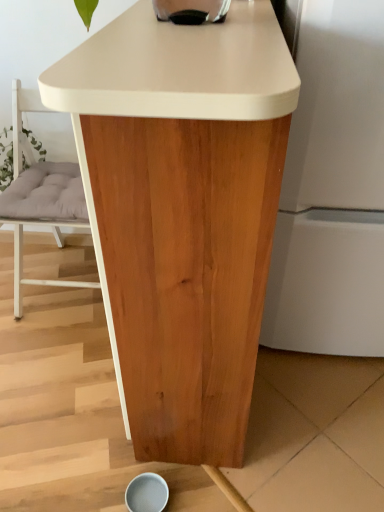
Locate an element on the screen. This screenshot has width=384, height=512. natural wood table at center is located at coordinates pos(182,212).

What do you see at coordinates (182, 212) in the screenshot? This screenshot has height=512, width=384. I see `natural wood table at center` at bounding box center [182, 212].

This screenshot has height=512, width=384. I want to click on light gray cushioned chair at center, so [x=39, y=195].

This screenshot has height=512, width=384. Describe the element at coordinates (39, 195) in the screenshot. I see `light gray cushioned chair at center` at that location.

The height and width of the screenshot is (512, 384). Identify the location of natural wood table at center. (182, 212).

From the picture: Is light gray cushioned chair at center at the left side of natural wood table at center?

Indeed, light gray cushioned chair at center is positioned on the left side of natural wood table at center.

From the picture: Is light gray cushioned chair at center further to camera compared to natural wood table at center?

Yes, light gray cushioned chair at center is further from the viewer.

Which is less distant, [19,96] or [293,100]?

Point [19,96].

From the image's perspective, is light gray cushioned chair at center beneath natural wood table at center?

No, from the image's perspective, light gray cushioned chair at center is not below natural wood table at center.

From a real-world perspective, is light gray cushioned chair at center under natural wood table at center?

Indeed, from a real-world perspective, light gray cushioned chair at center is positioned beneath natural wood table at center.

Can you confirm if light gray cushioned chair at center is thinner than natural wood table at center?

No, light gray cushioned chair at center is not thinner than natural wood table at center.

From their relative heights in the image, would you say light gray cushioned chair at center is taller or shorter than natural wood table at center?

In the image, light gray cushioned chair at center appears to be shorter than natural wood table at center.

Does light gray cushioned chair at center have a smaller size compared to natural wood table at center?

Yes.

Would you say light gray cushioned chair at center is inside or outside natural wood table at center?

light gray cushioned chair at center is located beyond the bounds of natural wood table at center.

Are light gray cushioned chair at center and natural wood table at center located far from each other?

Actually, light gray cushioned chair at center and natural wood table at center are a little close together.

Could you tell me if light gray cushioned chair at center is turned towards natural wood table at center?

No, light gray cushioned chair at center does not turn towards natural wood table at center.

How many degrees apart are the facing directions of light gray cushioned chair at center and natural wood table at center?

91 degrees.

Where is `chair that appears below the natural wood table at center (from a real-world perspective)`? chair that appears below the natural wood table at center (from a real-world perspective) is located at coordinates (39, 195).

Does natural wood table at center appear on the left side of light gray cushioned chair at center?

No.

Is natural wood table at center closer to the viewer compared to light gray cushioned chair at center?

Yes, natural wood table at center is closer to the camera.

Which is closer, [215,139] or [84,200]?

Point [215,139] is positioned closer to the camera compared to point [84,200].

From the image's perspective, does natural wood table at center appear lower than light gray cushioned chair at center?

Correct, natural wood table at center appears lower than light gray cushioned chair at center in the image.

From a real-world perspective, who is located higher, natural wood table at center or light gray cushioned chair at center?

From a 3D spatial view, natural wood table at center is above.

Considering the relative sizes of natural wood table at center and light gray cushioned chair at center in the image provided, is natural wood table at center wider than light gray cushioned chair at center?

No.

Considering the relative sizes of natural wood table at center and light gray cushioned chair at center in the image provided, is natural wood table at center shorter than light gray cushioned chair at center?

No, natural wood table at center is not shorter than light gray cushioned chair at center.

Who is smaller, natural wood table at center or light gray cushioned chair at center?

light gray cushioned chair at center.

Do you think natural wood table at center is within light gray cushioned chair at center, or outside of it?

natural wood table at center is located beyond the bounds of light gray cushioned chair at center.

Would you consider natural wood table at center to be distant from light gray cushioned chair at center?

They are positioned close to each other.

Is natural wood table at center facing towards light gray cushioned chair at center?

Yes.

Can you tell me how much natural wood table at center and light gray cushioned chair at center differ in facing direction?

They differ by 91 degrees in their facing directions.

How far apart are natural wood table at center and light gray cushioned chair at center?

The distance of natural wood table at center from light gray cushioned chair at center is 30.96 inches.

Locate an element on the screen. The width and height of the screenshot is (384, 512). chair located above the natural wood table at center (from the image's perspective) is located at coordinates (39, 195).

Identify the location of chair that is above the natural wood table at center (from the image's perspective). The height and width of the screenshot is (512, 384). (39, 195).

Find the location of a particular element. The height and width of the screenshot is (512, 384). chair below the natural wood table at center (from a real-world perspective) is located at coordinates (39, 195).